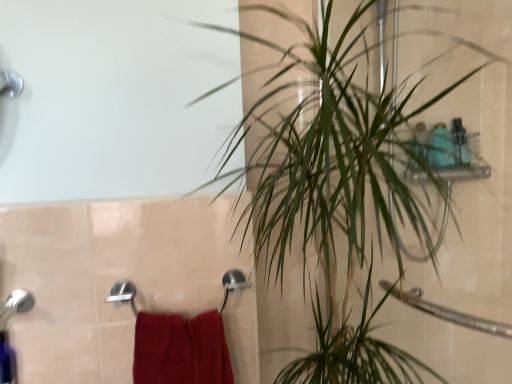
Question: Choose the correct answer: Is green leafy plant at upper right inside red cotton towel at lower left or outside it?

Choices:
 (A) inside
 (B) outside

Answer: (B)

Question: Based on their positions, is green leafy plant at upper right located to the left or right of red cotton towel at lower left?

Choices:
 (A) right
 (B) left

Answer: (A)

Question: Considering the positions of point (454, 281) and point (168, 344), is point (454, 281) closer or farther from the camera than point (168, 344)?

Choices:
 (A) farther
 (B) closer

Answer: (A)

Question: Would you say red cotton towel at lower left is inside or outside green leafy plant at upper right?

Choices:
 (A) outside
 (B) inside

Answer: (A)

Question: Looking at their shapes, would you say red cotton towel at lower left is wider or thinner than green leafy plant at upper right?

Choices:
 (A) wide
 (B) thin

Answer: (B)

Question: From a real-world perspective, is red cotton towel at lower left above or below green leafy plant at upper right?

Choices:
 (A) above
 (B) below

Answer: (B)

Question: Is red cotton towel at lower left bigger or smaller than green leafy plant at upper right?

Choices:
 (A) big
 (B) small

Answer: (B)